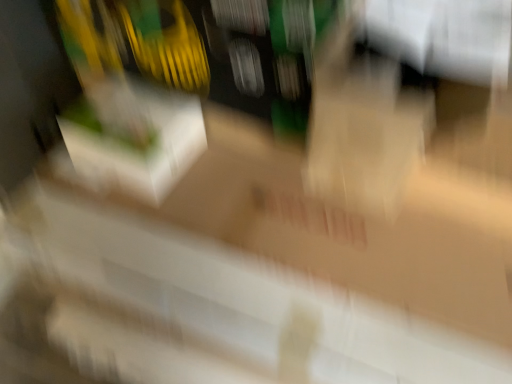
You are a GUI agent. You are given a task and a screenshot of the screen. Output one action in this format:
    pyautogui.click(x=<x>, y=<y>)
    Task: Click on the white cardboard box at center
    The width and height of the screenshot is (512, 384).
    Given the screenshot: What is the action you would take?
    pyautogui.click(x=134, y=136)

The width and height of the screenshot is (512, 384). Describe the element at coordinates (134, 136) in the screenshot. I see `white cardboard box at center` at that location.

Locate an element on the screen. white cardboard box at center is located at coordinates pos(134,136).